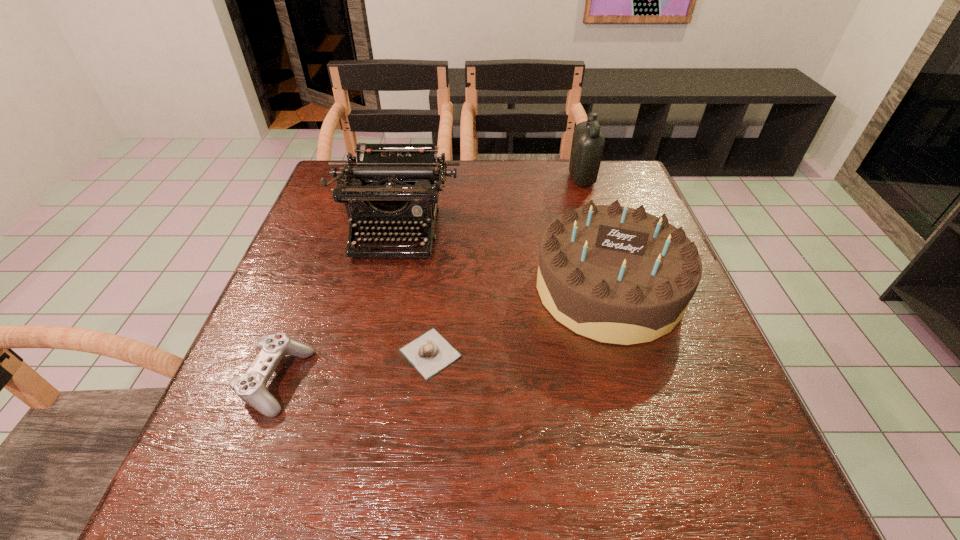
The image size is (960, 540). I want to click on free space at the left edge of the desktop, so click(x=325, y=221).

Find the location of a particular element. vacant space at the right edge of the desktop is located at coordinates (672, 382).

The height and width of the screenshot is (540, 960). In the image, there is a desktop. In order to click on free space at the far right corner in this screenshot , I will do `click(605, 189)`.

This screenshot has height=540, width=960. Find the location of `vacant space that is in between the typewriter and the shortest object`. vacant space that is in between the typewriter and the shortest object is located at coordinates (413, 292).

Where is `free space that is in between the bottle and the typewriter`? free space that is in between the bottle and the typewriter is located at coordinates (489, 205).

Where is `vacant region between the farthest object and the shortest object`? This screenshot has height=540, width=960. vacant region between the farthest object and the shortest object is located at coordinates (506, 266).

Identify the location of vacant space in between the typewriter and the farthest object. (489, 205).

The height and width of the screenshot is (540, 960). Identify the location of free space between the garlic and the control. (353, 367).

In order to click on free space between the second shortest object and the typewriter in this screenshot , I will do `click(336, 306)`.

Image resolution: width=960 pixels, height=540 pixels. What are the coordinates of `free space between the farthest object and the fourth tallest object` in the screenshot? It's located at (429, 280).